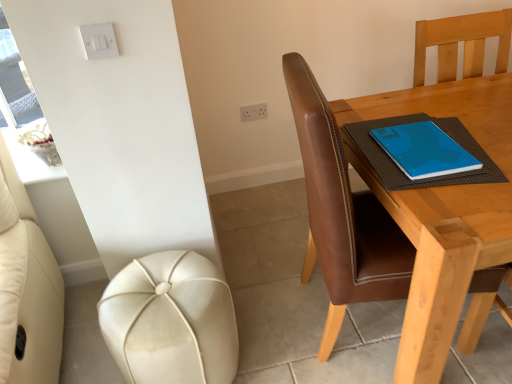
Question: Can you confirm if brown leather chair at right is positioned to the right of white plastic light switch at upper left?

Choices:
 (A) no
 (B) yes

Answer: (B)

Question: Is brown leather chair at right next to white plastic light switch at upper left?

Choices:
 (A) yes
 (B) no

Answer: (B)

Question: Is brown leather chair at right smaller than white plastic light switch at upper left?

Choices:
 (A) yes
 (B) no

Answer: (B)

Question: From the image's perspective, is brown leather chair at right over white plastic light switch at upper left?

Choices:
 (A) yes
 (B) no

Answer: (B)

Question: Is brown leather chair at right far away from white plastic light switch at upper left?

Choices:
 (A) yes
 (B) no

Answer: (B)

Question: Would you say white plastic light switch at upper left is part of brown leather chair at right's contents?

Choices:
 (A) no
 (B) yes

Answer: (A)

Question: Is leather-like cream stool at lower left thinner than brown leather chair at right?

Choices:
 (A) yes
 (B) no

Answer: (A)

Question: Does leather-like cream stool at lower left have a lesser height compared to brown leather chair at right?

Choices:
 (A) no
 (B) yes

Answer: (B)

Question: Is leather-like cream stool at lower left not within brown leather chair at right?

Choices:
 (A) no
 (B) yes

Answer: (B)

Question: From a real-world perspective, is leather-like cream stool at lower left physically above brown leather chair at right?

Choices:
 (A) yes
 (B) no

Answer: (B)

Question: Is leather-like cream stool at lower left turned away from brown leather chair at right?

Choices:
 (A) no
 (B) yes

Answer: (A)

Question: Can brown leather chair at right be found inside leather-like cream stool at lower left?

Choices:
 (A) yes
 (B) no

Answer: (B)

Question: Can you confirm if leather-like cream stool at lower left is thinner than white plastic light switch at upper left?

Choices:
 (A) no
 (B) yes

Answer: (A)